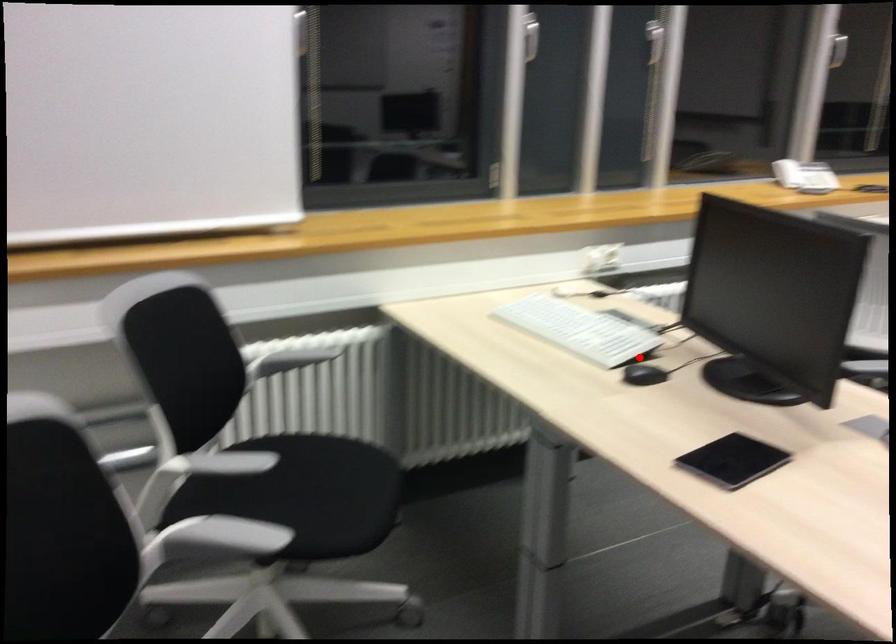
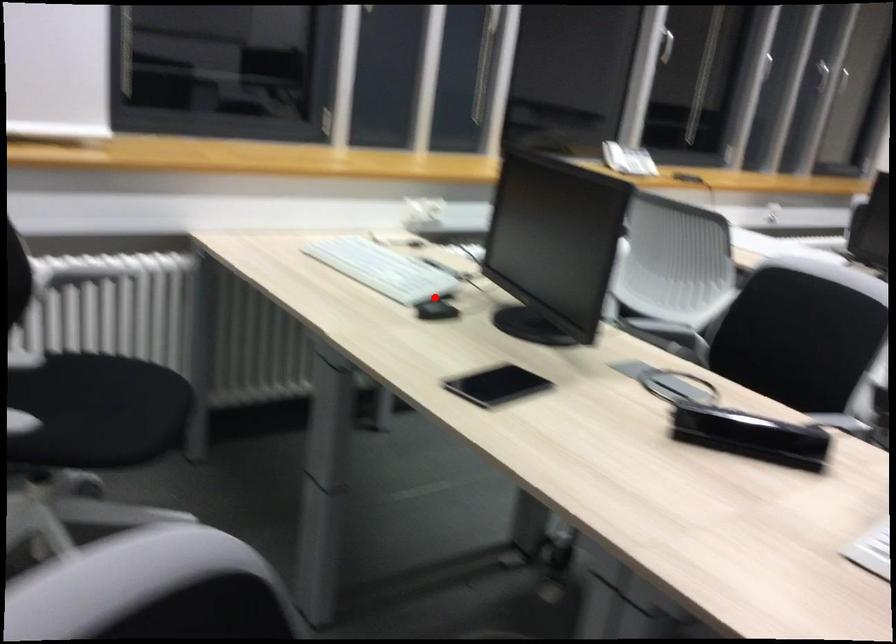
I am providing you with two images of the same scene from different viewpoints. A red point is marked on the first image and another point is marked on the second image. Is the marked point in image1 the same physical position as the marked point in image2?

Yes